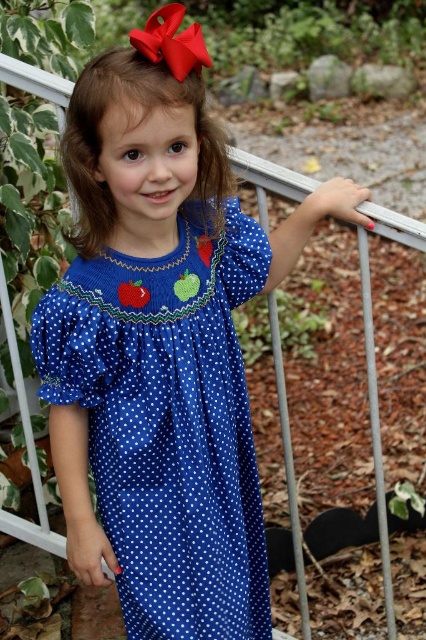
You are a photographer trying to capture the girl in the image. You want to place a focus point at the exact center of the girl. However, your camera only allows you to place the focus point at coordinates given by the point provided. Is the point at coordinates point (143, 116) on the girl?

Yes, the point (143, 116) is on the brown silky hair at upper center, which is part of the girl, so placing the focus point there will focus on her.

The young girl is wearing a blue polka dot dress at center and has brown silky hair at upper center. Which object is positioned to the right side of the other?

The blue polka dot dress at center is to the right of brown silky hair at upper center.

Based on the scene description, which object is wider, the blue polka dot dress at center or the brown silky hair at upper center?

The blue polka dot dress at center is wider than the brown silky hair at upper center according to the description.